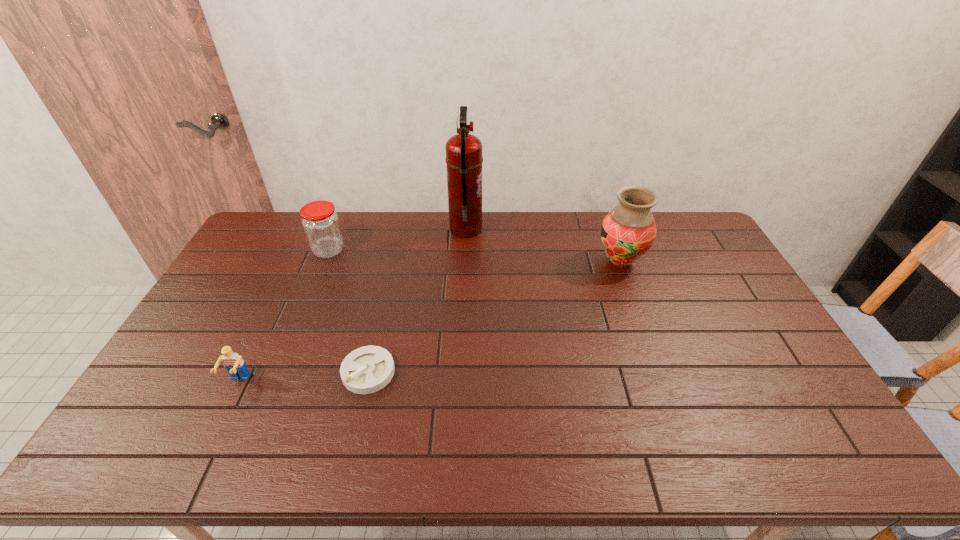
Locate an element on the screen. the second object from right to left is located at coordinates (464, 159).

What are the coordinates of `the tallest object` in the screenshot? It's located at (464, 159).

Find the location of `the second tallest object`. the second tallest object is located at coordinates (628, 231).

Locate an element on the screen. This screenshot has height=540, width=960. vase is located at coordinates (628, 231).

Image resolution: width=960 pixels, height=540 pixels. In order to click on the fourth object from right to left in this screenshot , I will do `click(320, 222)`.

This screenshot has height=540, width=960. I want to click on jar, so click(320, 222).

Where is `the fourth tallest object`? the fourth tallest object is located at coordinates (234, 364).

This screenshot has width=960, height=540. What are the coordinates of `Lego` in the screenshot? It's located at (234, 364).

The image size is (960, 540). What are the coordinates of `the shortest object` in the screenshot? It's located at (368, 369).

Find the location of a particular element. This screenshot has height=540, width=960. the third object from right to left is located at coordinates (368, 369).